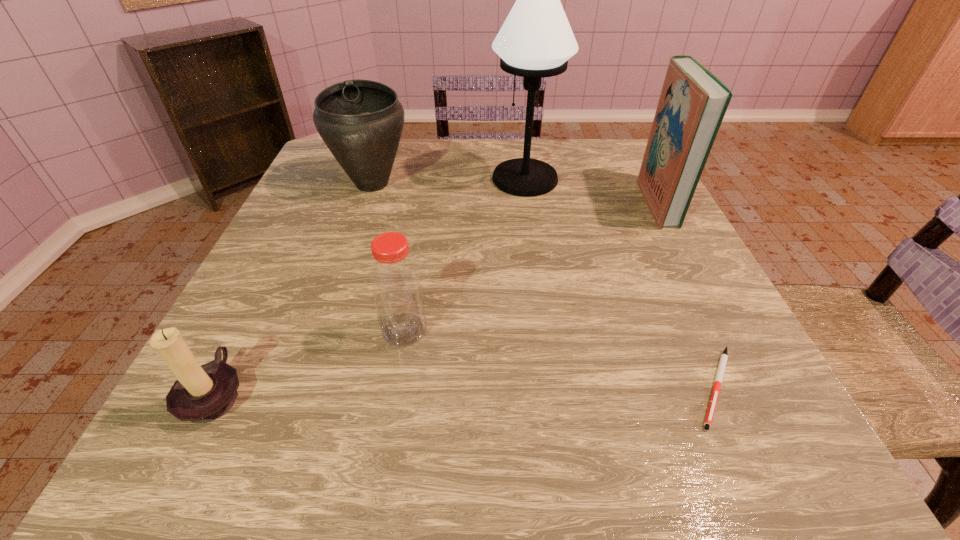
Locate an element on the screen. candle holder positioned at the left edge is located at coordinates (201, 394).

Find the location of a particular element. The height and width of the screenshot is (540, 960). hardback book present at the right edge is located at coordinates (693, 102).

You are a GUI agent. You are given a task and a screenshot of the screen. Output one action in this format:
    pyautogui.click(x=<x>, y=<y>)
    Task: Click on the pen that is positioned at the right edge
    The image size is (960, 540).
    Given the screenshot: What is the action you would take?
    pyautogui.click(x=723, y=360)

You are a GUI agent. You are given a task and a screenshot of the screen. Output one action in this format:
    pyautogui.click(x=<x>, y=<y>)
    Task: Click on the object at the far left corner
    Image resolution: width=960 pixels, height=540 pixels.
    Given the screenshot: What is the action you would take?
    pyautogui.click(x=361, y=121)

Where is `object that is at the near left corner`? The image size is (960, 540). object that is at the near left corner is located at coordinates (201, 394).

Where is `object present at the far right corner`? This screenshot has height=540, width=960. object present at the far right corner is located at coordinates (693, 102).

Identify the location of object that is at the near right corner. Image resolution: width=960 pixels, height=540 pixels. (723, 360).

Locate an element on the screen. The height and width of the screenshot is (540, 960). vacant region at the far edge of the desktop is located at coordinates (578, 157).

Locate an element on the screen. This screenshot has width=960, height=540. blank space at the left edge of the desktop is located at coordinates (310, 243).

Find the location of a particular element. The width and height of the screenshot is (960, 540). free point at the right edge is located at coordinates (698, 275).